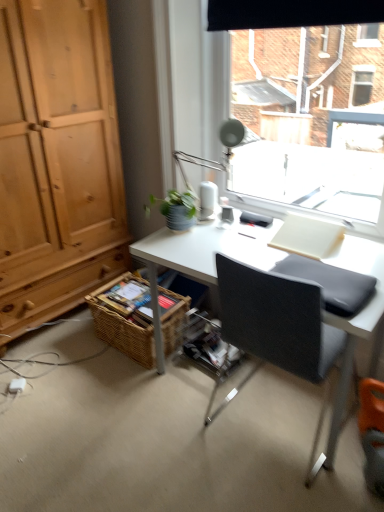
Question: Should I look upward or downward to see matte silver table lamp at upper center?

Choices:
 (A) down
 (B) up

Answer: (B)

Question: Does transparent glass window at upper center have a greater height compared to woven brown basket at lower left?

Choices:
 (A) no
 (B) yes

Answer: (B)

Question: Is transparent glass window at upper center wider than woven brown basket at lower left?

Choices:
 (A) yes
 (B) no

Answer: (B)

Question: Considering the relative sizes of transparent glass window at upper center and woven brown basket at lower left in the image provided, is transparent glass window at upper center bigger than woven brown basket at lower left?

Choices:
 (A) no
 (B) yes

Answer: (B)

Question: Is transparent glass window at upper center next to woven brown basket at lower left and touching it?

Choices:
 (A) yes
 (B) no

Answer: (B)

Question: Would you say transparent glass window at upper center is outside woven brown basket at lower left?

Choices:
 (A) no
 (B) yes

Answer: (B)

Question: Does transparent glass window at upper center come behind woven brown basket at lower left?

Choices:
 (A) yes
 (B) no

Answer: (B)

Question: Is black fabric chair at center behind transparent glass window at upper center?

Choices:
 (A) yes
 (B) no

Answer: (B)

Question: Considering the relative sizes of black fabric chair at center and transparent glass window at upper center in the image provided, is black fabric chair at center wider than transparent glass window at upper center?

Choices:
 (A) yes
 (B) no

Answer: (A)

Question: From the image's perspective, does black fabric chair at center appear lower than transparent glass window at upper center?

Choices:
 (A) no
 (B) yes

Answer: (B)

Question: From a real-world perspective, is black fabric chair at center positioned over transparent glass window at upper center based on gravity?

Choices:
 (A) no
 (B) yes

Answer: (A)

Question: Is black fabric chair at center to the right of transparent glass window at upper center from the viewer's perspective?

Choices:
 (A) yes
 (B) no

Answer: (A)

Question: Is black fabric chair at center at the left side of transparent glass window at upper center?

Choices:
 (A) yes
 (B) no

Answer: (B)

Question: From a real-world perspective, is black fabric chair at center beneath woven brown basket at lower left?

Choices:
 (A) no
 (B) yes

Answer: (A)